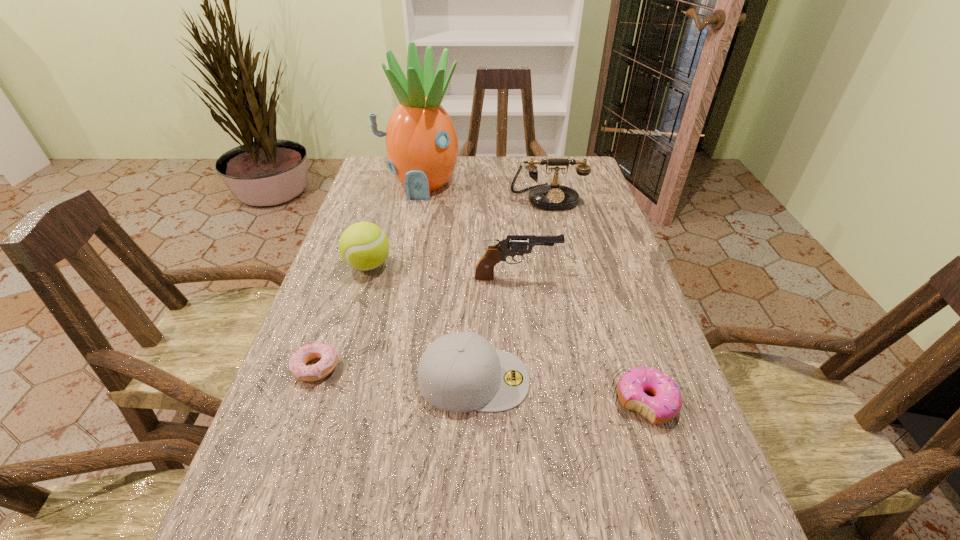
At what (x,y) coordinates should I click in order to perform the action: click on doughnut that is positioned at the left edge. Please return your answer as a coordinate pair (x, y). Looking at the image, I should click on (297, 364).

The image size is (960, 540). I want to click on telephone that is at the right edge, so click(554, 196).

Where is `doughnut located at the right edge`? Image resolution: width=960 pixels, height=540 pixels. doughnut located at the right edge is located at coordinates (666, 404).

This screenshot has width=960, height=540. I want to click on object present at the far left corner, so [422, 147].

Image resolution: width=960 pixels, height=540 pixels. I want to click on object that is at the far right corner, so click(x=554, y=196).

This screenshot has width=960, height=540. Identify the location of vacant region at the far edge of the desktop. (500, 178).

At what (x,y) coordinates should I click in order to perform the action: click on vacant space at the left edge. Please return your answer as a coordinate pair (x, y). The height and width of the screenshot is (540, 960). Looking at the image, I should click on (378, 301).

Where is `free space at the right edge of the desktop`? The width and height of the screenshot is (960, 540). free space at the right edge of the desktop is located at coordinates (566, 210).

Image resolution: width=960 pixels, height=540 pixels. I want to click on vacant space at the far right corner of the desktop, so click(586, 184).

You are a GUI agent. You are given a task and a screenshot of the screen. Output one action in this format:
    pyautogui.click(x=<x>, y=<y>)
    Task: Click on the free space between the shorter doughnut and the tallest object
    The height and width of the screenshot is (540, 960).
    Given the screenshot: What is the action you would take?
    pyautogui.click(x=368, y=275)